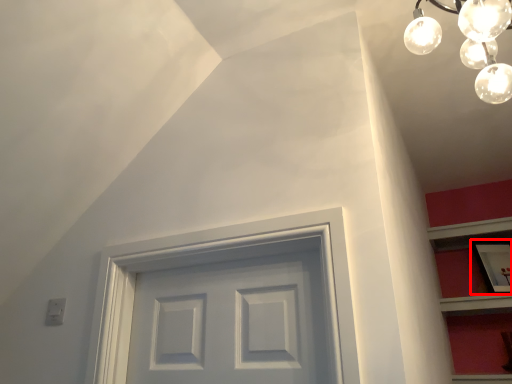
Question: Where is picture frame (annotated by the red box) located in relation to light fixture in the image?

Choices:
 (A) left
 (B) right

Answer: (B)